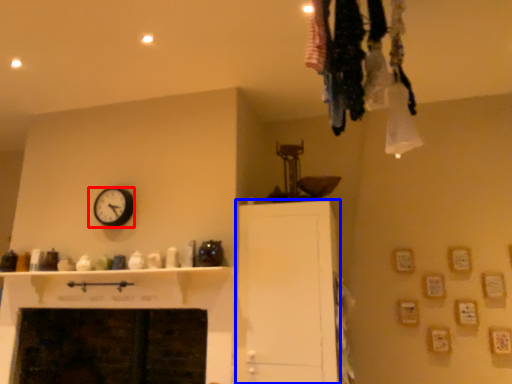
Question: Which point is further to the camera, wall clock (highlighted by a red box) or cabinetry (highlighted by a blue box)?

Choices:
 (A) wall clock
 (B) cabinetry

Answer: (A)